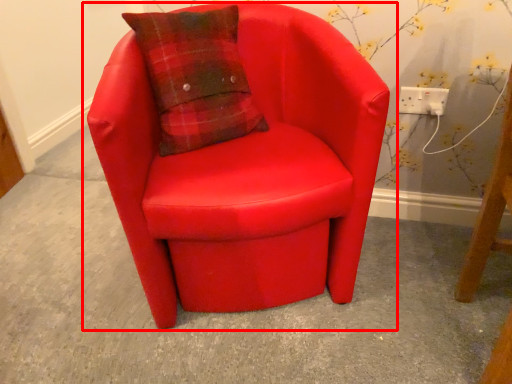
Question: Where is chair (annotated by the red box) located in relation to electric outlet in the image?

Choices:
 (A) right
 (B) left

Answer: (B)